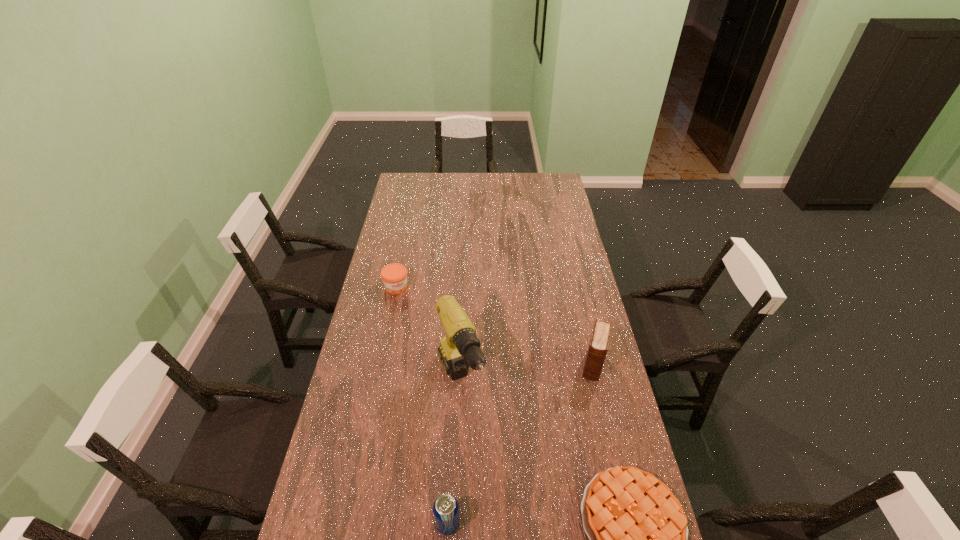
In the image, there is a desktop. Find the location of `vacant area at the right edge`. vacant area at the right edge is located at coordinates (546, 215).

Where is `free space at the far left corner of the desktop`? free space at the far left corner of the desktop is located at coordinates (408, 187).

Identify the location of vacant region at the far right corner of the desktop. The height and width of the screenshot is (540, 960). (553, 194).

The height and width of the screenshot is (540, 960). Find the location of `free area in between the drill and the third tallest object`. free area in between the drill and the third tallest object is located at coordinates (454, 453).

Image resolution: width=960 pixels, height=540 pixels. Find the location of `free spot between the diary and the tallest object`. free spot between the diary and the tallest object is located at coordinates (527, 374).

I want to click on free point between the tallest object and the third shortest object, so click(454, 453).

Identify the location of empty space between the diary and the jam. (494, 326).

Locate an element on the screen. Image resolution: width=960 pixels, height=540 pixels. vacant space that's between the third shortest object and the jam is located at coordinates (422, 406).

Locate an element on the screen. The width and height of the screenshot is (960, 540). free area in between the second shortest object and the third tallest object is located at coordinates (422, 406).

Where is `vacant area that lies between the drill and the farthest object`? The width and height of the screenshot is (960, 540). vacant area that lies between the drill and the farthest object is located at coordinates (428, 335).